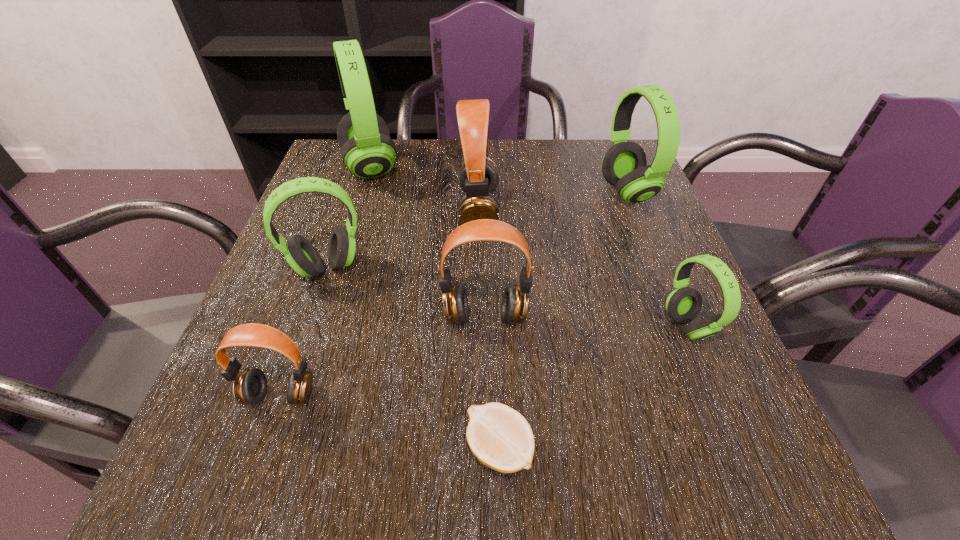
This screenshot has height=540, width=960. Identify the location of unoccupied area between the nearest green headset and the tallest headset. (529, 246).

What are the coordinates of `free space between the tallest headset and the smallest green headset` in the screenshot? It's located at (529, 246).

The height and width of the screenshot is (540, 960). I want to click on free space that is in between the third smallest green headset and the nearest object, so click(x=563, y=320).

At what (x,y) coordinates should I click in order to perform the action: click on vacant space that is in between the third biggest green headset and the second nearest brown headset. Please return your answer as a coordinate pair (x, y). The height and width of the screenshot is (540, 960). Looking at the image, I should click on (406, 292).

Where is `free point between the second smallest brown headset and the second smallest green headset`? The width and height of the screenshot is (960, 540). free point between the second smallest brown headset and the second smallest green headset is located at coordinates (406, 292).

The width and height of the screenshot is (960, 540). I want to click on free area in between the third farthest green headset and the nearest brown headset, so click(304, 331).

Locate an element on the screen. The height and width of the screenshot is (540, 960). unoccupied area between the smallest green headset and the farthest brown headset is located at coordinates (583, 267).

Where is `free spot between the biggest green headset and the second smallest brown headset`? The height and width of the screenshot is (540, 960). free spot between the biggest green headset and the second smallest brown headset is located at coordinates (428, 242).

In order to click on empty space that is in between the fifth nearest object and the second smallest brown headset in this screenshot , I will do `click(406, 292)`.

Locate an element on the screen. object that is the closest to the third biggest green headset is located at coordinates 514,307.